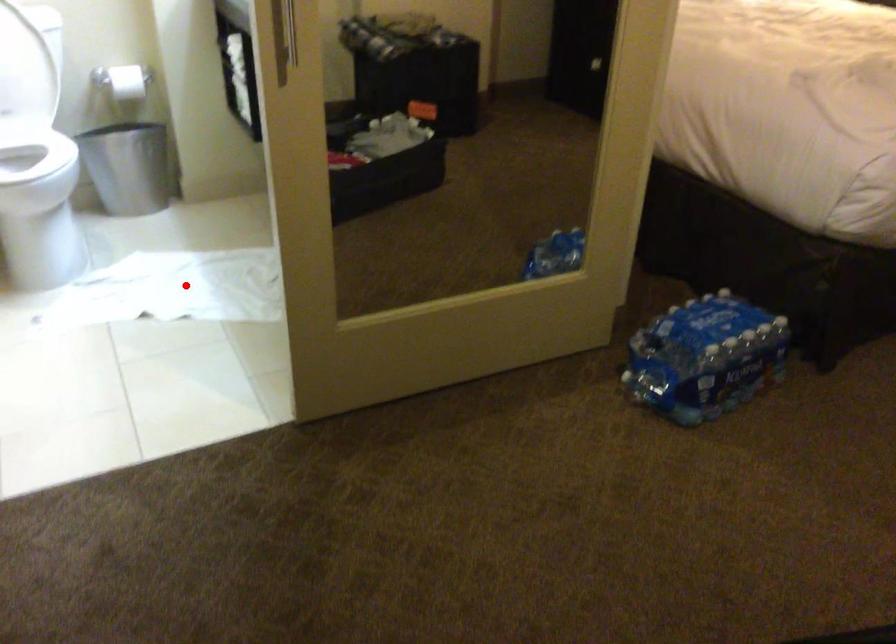
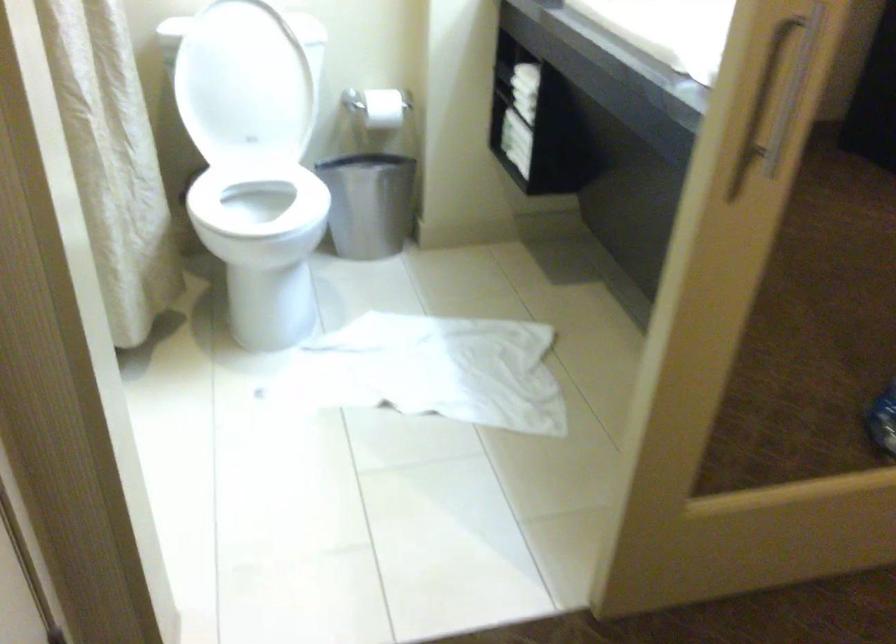
Question: A red point is marked in image1. In image2, is the corresponding 3D point closer to the camera or farther? Reply with the corresponding letter.

Choices:
 (A) The corresponding 3D point is closer.
 (B) The corresponding 3D point is farther.

Answer: (A)